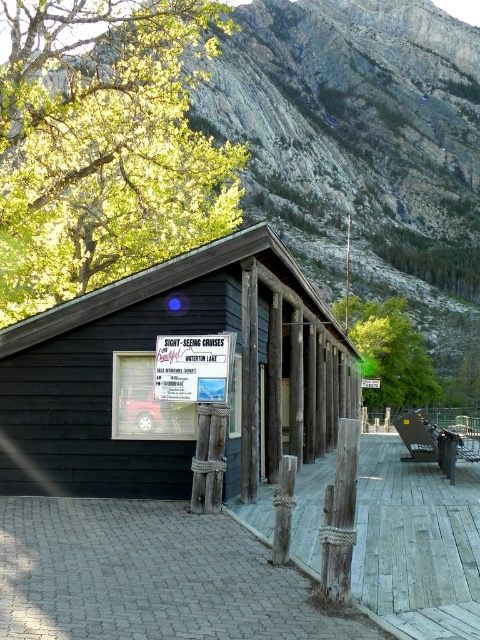
Question: Can you confirm if weathered wood dock at lower center is smaller than green leafy tree at center?

Choices:
 (A) yes
 (B) no

Answer: (A)

Question: Observing the image, what is the correct spatial positioning of rugged stone mountain at upper center in reference to green leafy tree at upper left?

Choices:
 (A) below
 (B) above

Answer: (B)

Question: Which is nearer to the weathered wood dock at lower center?

Choices:
 (A) rugged stone mountain at upper center
 (B) green leafy tree at upper left
 (C) green leafy tree at center

Answer: (B)

Question: Which of the following is the closest to the observer?

Choices:
 (A) weathered wood dock at lower center
 (B) green leafy tree at center
 (C) rugged stone mountain at upper center

Answer: (A)

Question: From the image, what is the correct spatial relationship of green leafy tree at center in relation to white paper sign at center?

Choices:
 (A) right
 (B) left

Answer: (A)

Question: Considering the real-world distances, which object is closest to the white paper sign at center?

Choices:
 (A) green leafy tree at center
 (B) green leafy tree at upper left
 (C) weathered wood dock at lower center

Answer: (C)